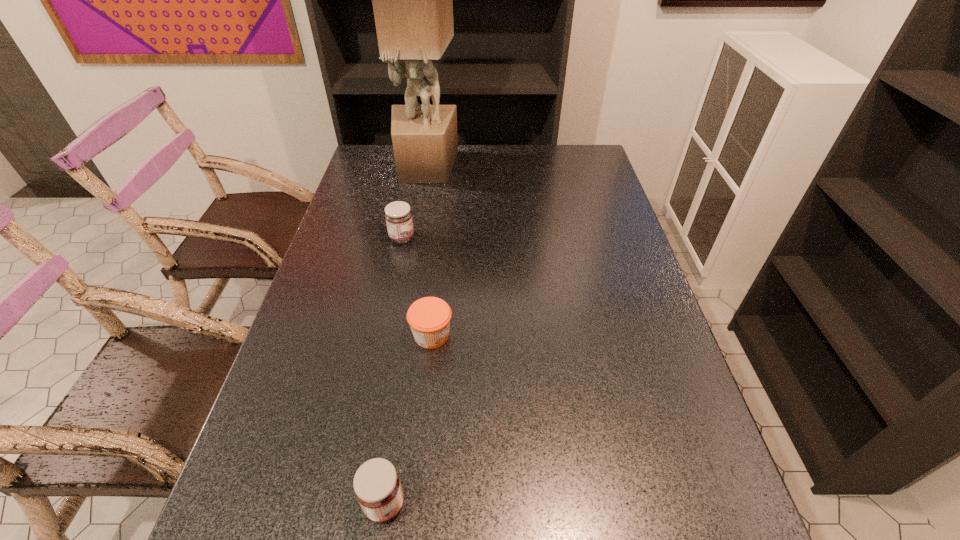
I want to click on object at the far edge, so click(412, 0).

The height and width of the screenshot is (540, 960). Identify the location of object located in the left edge section of the desktop. (x=412, y=0).

The width and height of the screenshot is (960, 540). In order to click on object located in the far left corner section of the desktop in this screenshot , I will do `click(412, 0)`.

You are a GUI agent. You are given a task and a screenshot of the screen. Output one action in this format:
    pyautogui.click(x=<x>, y=<y>)
    Task: Click on the vacant region at the far edge of the desktop
    This screenshot has height=540, width=960.
    Given the screenshot: What is the action you would take?
    pyautogui.click(x=542, y=146)

In the image, there is a desktop. Where is `vacant space at the left edge`? This screenshot has width=960, height=540. vacant space at the left edge is located at coordinates (395, 194).

Identify the location of blank space at the right edge. (580, 177).

At what (x,y) coordinates should I click in order to perform the action: click on vacant space at the far right corner of the desktop. Please return your answer as a coordinate pair (x, y). The height and width of the screenshot is (540, 960). Looking at the image, I should click on (561, 147).

At what (x,y) coordinates should I click in order to perform the action: click on vacant region between the third nearest object and the tallest object. Please return your answer as a coordinate pair (x, y). This screenshot has width=960, height=540. Looking at the image, I should click on click(x=414, y=202).

Where is `empty space that is in between the nearest object and the tallest object`? This screenshot has height=540, width=960. empty space that is in between the nearest object and the tallest object is located at coordinates (405, 335).

Image resolution: width=960 pixels, height=540 pixels. Find the location of `vacant area that lies between the second nearest object and the nearest object`. vacant area that lies between the second nearest object and the nearest object is located at coordinates click(408, 419).